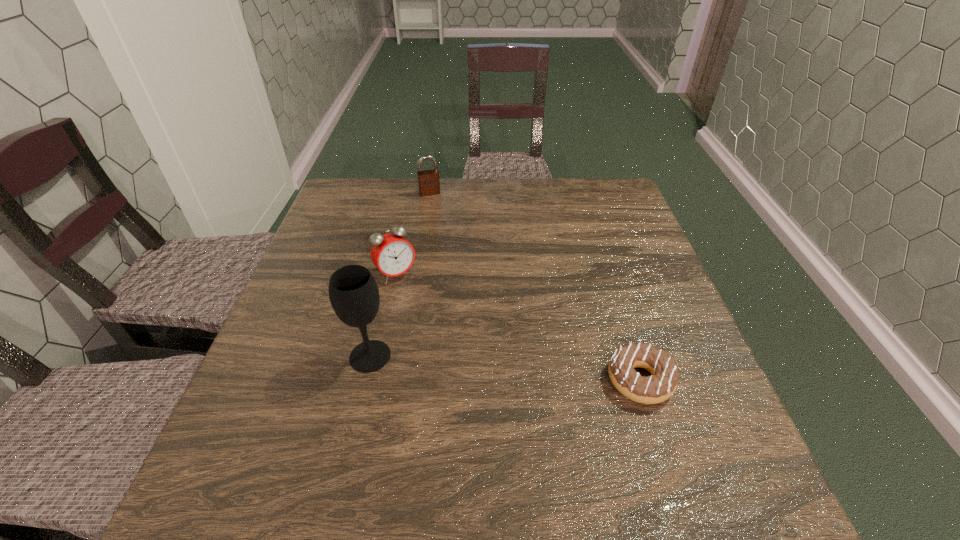
This screenshot has height=540, width=960. In order to click on the tallest object in this screenshot , I will do `click(353, 292)`.

Find the location of a particular element. The height and width of the screenshot is (540, 960). the rightmost object is located at coordinates (657, 388).

The height and width of the screenshot is (540, 960). Identify the location of doughnut. (657, 388).

Identify the location of alarm clock. coord(391,253).

I want to click on the farthest object, so click(x=428, y=180).

I want to click on free region located 0.320m on the back of the tallest object, so click(x=396, y=246).

Locate an element on the screen. This screenshot has width=960, height=540. vacant space located on the back of the rightmost object is located at coordinates (x=611, y=287).

Find the location of a particular element. The height and width of the screenshot is (540, 960). vacant space located 0.140m on the front-facing side of the second farthest object is located at coordinates click(433, 321).

At what (x,y) coordinates should I click in order to perform the action: click on vacant area situated on the front-facing side of the second farthest object. Please return your answer as a coordinate pair (x, y). The image size is (960, 540). Looking at the image, I should click on (482, 387).

Identify the location of free point located 0.120m on the front-facing side of the second farthest object. (428, 316).